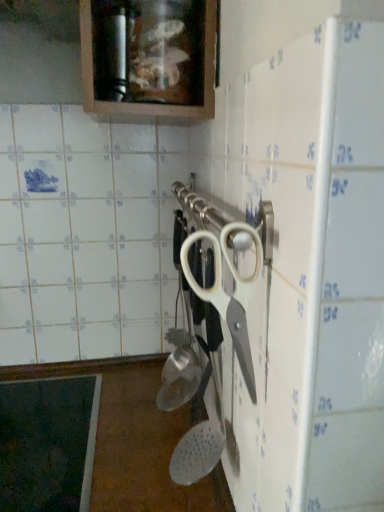
What do you see at coordinates (227, 294) in the screenshot? I see `white plastic scissors at center` at bounding box center [227, 294].

You are a GUI agent. You are given a task and a screenshot of the screen. Output one action in this format:
    pyautogui.click(x=<x>, y=<y>)
    Task: Click on the white plastic scissors at center
    This screenshot has width=384, height=512.
    Given the screenshot: What is the action you would take?
    pyautogui.click(x=227, y=294)

Measure the distance between white plastic scissors at center and camera.

white plastic scissors at center is 16.20 inches away from camera.

Describe the element at coordinates (149, 58) in the screenshot. I see `matte wood cabinet at upper center` at that location.

You are a GUI agent. You are given a task and a screenshot of the screen. Output one action in this format:
    pyautogui.click(x=<x>, y=<y>)
    Task: Click on the matte wood cabinet at upper center
    
    Given the screenshot: What is the action you would take?
    pyautogui.click(x=149, y=58)

This screenshot has height=512, width=384. In order to click on white plastic scissors at center in this screenshot , I will do `click(227, 294)`.

Which object is positioned more to the left, white plastic scissors at center or matte wood cabinet at upper center?

matte wood cabinet at upper center.

Does white plastic scissors at center come behind matte wood cabinet at upper center?

No, white plastic scissors at center is in front of matte wood cabinet at upper center.

Does point (226, 244) lie behind point (179, 24)?

No, (226, 244) is in front of (179, 24).

From the image's perspective, which one is positioned higher, white plastic scissors at center or matte wood cabinet at upper center?

matte wood cabinet at upper center.

From a real-world perspective, is white plastic scissors at center beneath matte wood cabinet at upper center?

Yes, from a real-world perspective, white plastic scissors at center is beneath matte wood cabinet at upper center.

Considering the sizes of white plastic scissors at center and matte wood cabinet at upper center in the image, is white plastic scissors at center wider or thinner than matte wood cabinet at upper center?

Considering their sizes, white plastic scissors at center looks slimmer than matte wood cabinet at upper center.

Can you confirm if white plastic scissors at center is taller than matte wood cabinet at upper center?

Correct, white plastic scissors at center is much taller as matte wood cabinet at upper center.

Considering the relative sizes of white plastic scissors at center and matte wood cabinet at upper center in the image provided, is white plastic scissors at center smaller than matte wood cabinet at upper center?

Yes, white plastic scissors at center is smaller than matte wood cabinet at upper center.

Is matte wood cabinet at upper center surrounded by white plastic scissors at center?

No, white plastic scissors at center does not contain matte wood cabinet at upper center.

Is white plastic scissors at center far away from matte wood cabinet at upper center?

No, white plastic scissors at center is not far away from matte wood cabinet at upper center.

Is white plastic scissors at center aimed at matte wood cabinet at upper center?

No, white plastic scissors at center is not facing towards matte wood cabinet at upper center.

How many degrees apart are the facing directions of white plastic scissors at center and matte wood cabinet at upper center?

The angular difference between white plastic scissors at center and matte wood cabinet at upper center is 85.8 degrees.

The image size is (384, 512). What are the coordinates of `scissors lying in front of the matte wood cabinet at upper center` in the screenshot? It's located at (x=227, y=294).

Can you confirm if matte wood cabinet at upper center is positioned to the right of white plastic scissors at center?

In fact, matte wood cabinet at upper center is to the left of white plastic scissors at center.

Which object is more forward, matte wood cabinet at upper center or white plastic scissors at center?

Positioned in front is white plastic scissors at center.

Is point (116, 13) closer to camera compared to point (234, 270)?

No, (116, 13) is behind (234, 270).

Based on the photo, from the image's perspective, which one is positioned lower, matte wood cabinet at upper center or white plastic scissors at center?

white plastic scissors at center.

Based on the photo, from a real-world perspective, which is physically below, matte wood cabinet at upper center or white plastic scissors at center?

white plastic scissors at center.

In the scene shown: Considering the relative sizes of matte wood cabinet at upper center and white plastic scissors at center in the image provided, is matte wood cabinet at upper center thinner than white plastic scissors at center?

No, matte wood cabinet at upper center is not thinner than white plastic scissors at center.

Which of these two, matte wood cabinet at upper center or white plastic scissors at center, stands taller?

With more height is white plastic scissors at center.

Considering the sizes of objects matte wood cabinet at upper center and white plastic scissors at center in the image provided, who is smaller, matte wood cabinet at upper center or white plastic scissors at center?

white plastic scissors at center is smaller.

From the picture: Is matte wood cabinet at upper center outside of white plastic scissors at center?

Yes.

Are matte wood cabinet at upper center and white plastic scissors at center beside each other?

No, matte wood cabinet at upper center is not next to white plastic scissors at center.

Is matte wood cabinet at upper center oriented towards white plastic scissors at center?

No, matte wood cabinet at upper center is not oriented towards white plastic scissors at center.

How many degrees apart are the facing directions of matte wood cabinet at upper center and white plastic scissors at center?

matte wood cabinet at upper center and white plastic scissors at center are facing 85.8 degrees away from each other.

Measure the distance between matte wood cabinet at upper center and white plastic scissors at center.

A distance of 12.57 inches exists between matte wood cabinet at upper center and white plastic scissors at center.

You are a GUI agent. You are given a task and a screenshot of the screen. Output one action in this format:
    pyautogui.click(x=<x>, y=<y>)
    Task: Click on the cabinetry on the left of white plastic scissors at center
    
    Given the screenshot: What is the action you would take?
    pyautogui.click(x=149, y=58)

The height and width of the screenshot is (512, 384). What are the coordinates of `cabinetry behind the white plastic scissors at center` in the screenshot? It's located at (149, 58).

The width and height of the screenshot is (384, 512). What are the coordinates of `scissors that appears in front of the matte wood cabinet at upper center` in the screenshot? It's located at (227, 294).